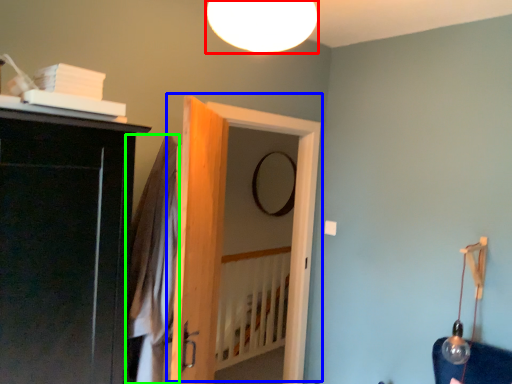
Question: Estimate the real-world distances between objects in this image. Which object is closer to lamp (highlighted by a red box), door (highlighted by a blue box) or robe (highlighted by a green box)?

Choices:
 (A) door
 (B) robe

Answer: (B)